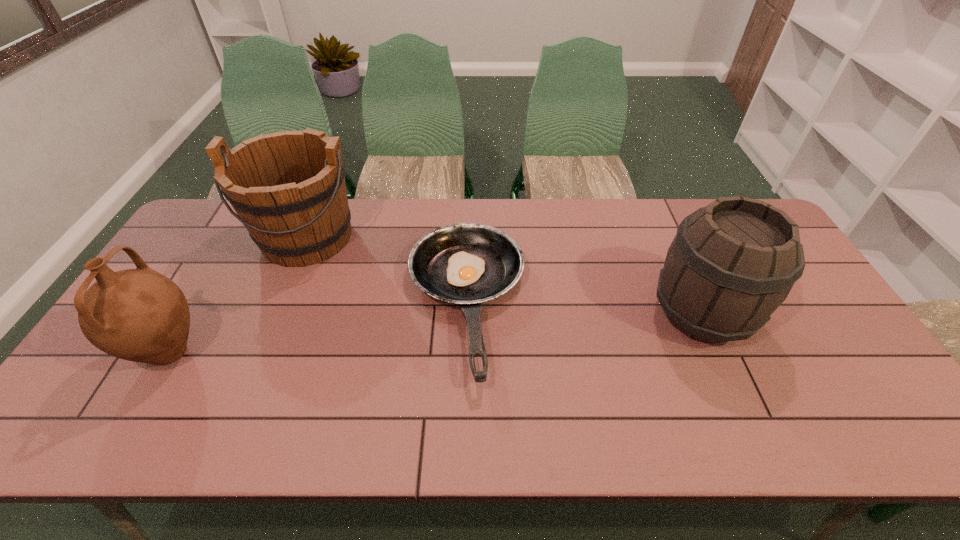
Where is `the left wine bucket`? Image resolution: width=960 pixels, height=540 pixels. the left wine bucket is located at coordinates (288, 188).

Where is `the nearer wine bucket`? The image size is (960, 540). the nearer wine bucket is located at coordinates (732, 263).

Locate an element on the screen. Image resolution: width=960 pixels, height=540 pixels. the right wine bucket is located at coordinates (732, 263).

Locate an element on the screen. pitcher is located at coordinates (139, 315).

Identify the location of the shortest object. (464, 263).

At what (x,y) coordinates should I click in order to perform the action: click on frying pan. Please return your answer as a coordinate pair (x, y). This screenshot has width=960, height=540. Looking at the image, I should click on (464, 263).

Where is `vacant space located 0.250m on the side of the farther wine bucket with the handle for carrying`? This screenshot has width=960, height=540. vacant space located 0.250m on the side of the farther wine bucket with the handle for carrying is located at coordinates (264, 342).

This screenshot has width=960, height=540. Find the location of `vacant space located on the front of the nearer wine bucket`. vacant space located on the front of the nearer wine bucket is located at coordinates coord(730,379).

Locate an element on the screen. The height and width of the screenshot is (540, 960). blank area located 0.300m on the right of the pitcher is located at coordinates (x=325, y=353).

At what (x,y) coordinates should I click in order to perform the action: click on free region located 0.380m on the right of the third object from left to right. Please return your answer as a coordinate pair (x, y). Image resolution: width=960 pixels, height=540 pixels. Looking at the image, I should click on (660, 303).